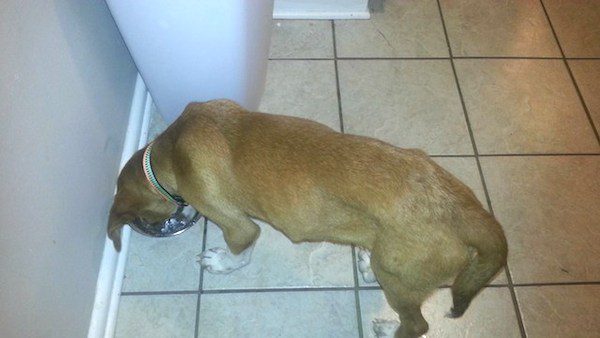
Where is `puppy food bowl`? This screenshot has height=338, width=600. puppy food bowl is located at coordinates (176, 226).